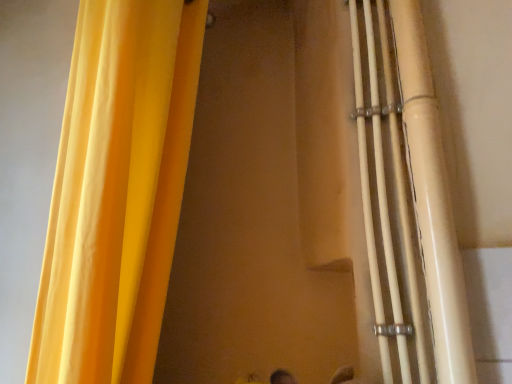
Question: Visually, is matte yellow curtain at left positioned to the left or to the right of white glossy pipes at right?

Choices:
 (A) left
 (B) right

Answer: (A)

Question: Is matte yellow curtain at left taller or shorter than white glossy pipes at right?

Choices:
 (A) tall
 (B) short

Answer: (A)

Question: Considering their positions, is matte yellow curtain at left located in front of or behind white glossy pipes at right?

Choices:
 (A) behind
 (B) front

Answer: (B)

Question: Would you say white glossy pipes at right is inside or outside matte yellow curtain at left?

Choices:
 (A) outside
 (B) inside

Answer: (A)

Question: Looking at their shapes, would you say white glossy pipes at right is wider or thinner than matte yellow curtain at left?

Choices:
 (A) wide
 (B) thin

Answer: (B)

Question: Is point (428, 157) closer or farther from the camera than point (122, 352)?

Choices:
 (A) farther
 (B) closer

Answer: (A)

Question: In terms of height, does white glossy pipes at right look taller or shorter compared to matte yellow curtain at left?

Choices:
 (A) short
 (B) tall

Answer: (A)